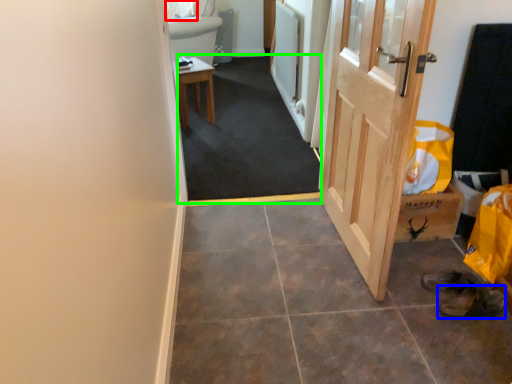
Question: Which object is the closest to the curtain (highlighted by a red box)? Choose among these: shoe (highlighted by a blue box) or corridor (highlighted by a green box).

Choices:
 (A) shoe
 (B) corridor

Answer: (B)